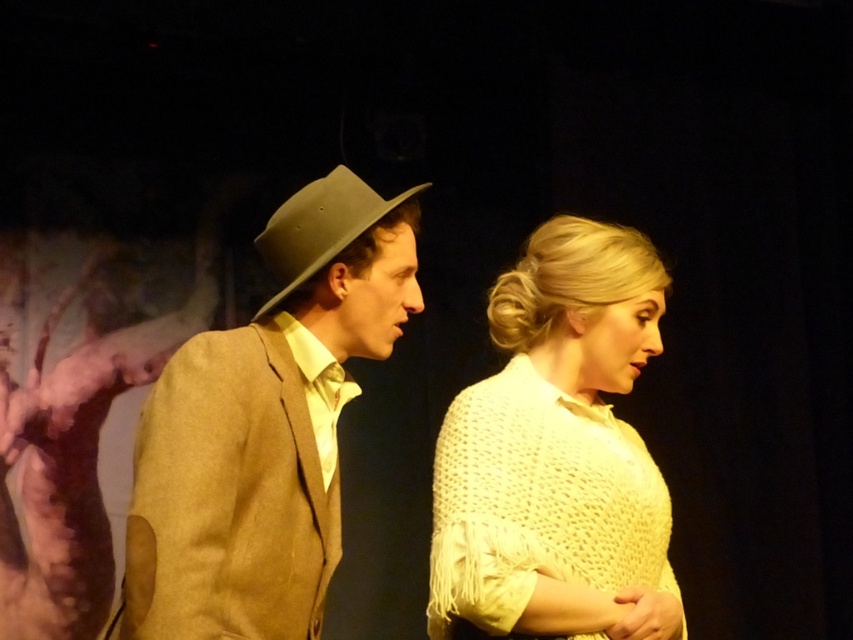
You are a costume designer preparing for a play. You have two items from the image to place on a mannequin. The matte brown suit at left and the matte brown hat at center. Given their sizes, which item should you place first to ensure proper fitting?

The matte brown suit at left is wider than the matte brown hat at center, so you should place the matte brown suit at left first to ensure proper fitting.